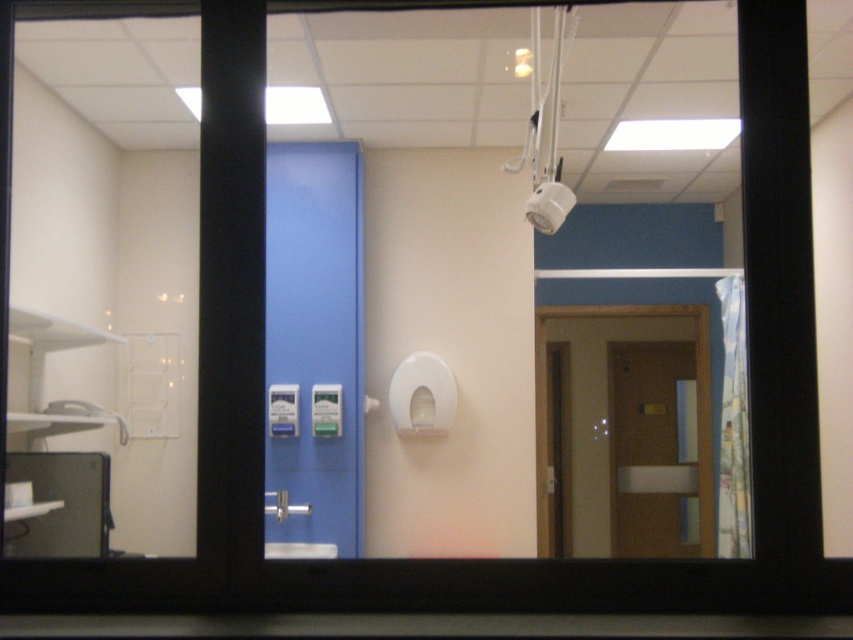
Question: Which object is closer to the camera taking this photo?

Choices:
 (A) matte brown door at right
 (B) blue glossy cabinet at center

Answer: (B)

Question: Is blue glossy cabinet at center further to the viewer compared to matte brown door at right?

Choices:
 (A) no
 (B) yes

Answer: (A)

Question: Does blue glossy cabinet at center have a larger size compared to matte brown door at right?

Choices:
 (A) no
 (B) yes

Answer: (A)

Question: Which point is closer to the camera?

Choices:
 (A) matte brown door at right
 (B) blue glossy cabinet at center

Answer: (B)

Question: Among these objects, which one is nearest to the camera?

Choices:
 (A) blue glossy cabinet at center
 (B) matte brown door at right

Answer: (A)

Question: Is blue glossy cabinet at center below matte brown door at right?

Choices:
 (A) no
 (B) yes

Answer: (A)